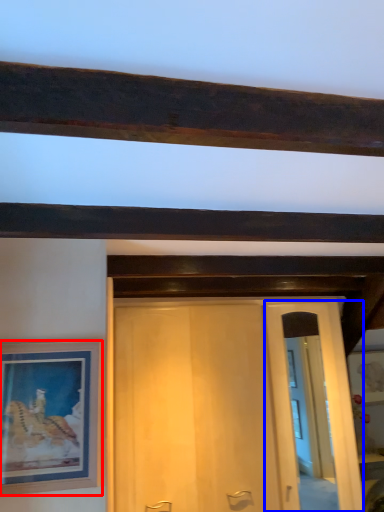
Question: Which object is further to the camera taking this photo, picture frame (highlighted by a red box) or glass door (highlighted by a blue box)?

Choices:
 (A) picture frame
 (B) glass door

Answer: (B)